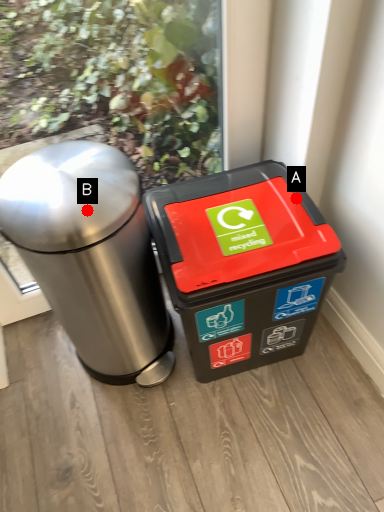
Question: Two points are circled on the image, labeled by A and B beside each circle. Which of the following is the farthest from the observer?

Choices:
 (A) A is further
 (B) B is further

Answer: (A)